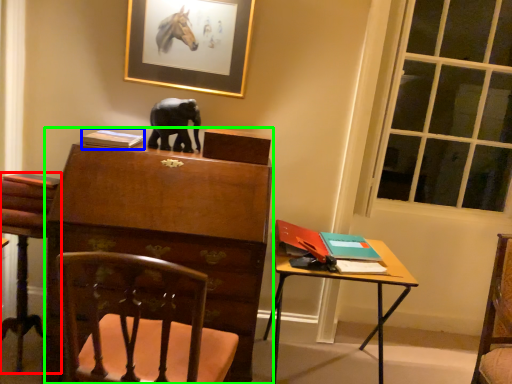
Question: Which object is positioned farthest from chair (highlighted by a red box)? Select from book (highlighted by a blue box) and chest of drawers (highlighted by a green box).

Choices:
 (A) book
 (B) chest of drawers

Answer: (A)